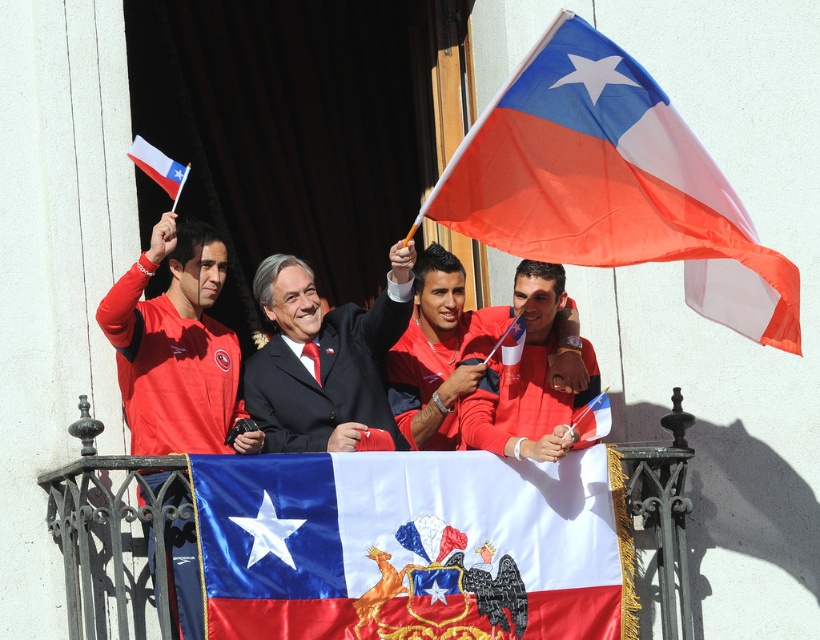
Question: Among these objects, which one is farthest from the camera?

Choices:
 (A) matte fabric flag at center
 (B) matte black suit at center
 (C) matte red jacket at center
 (D) matte orange flag at upper right

Answer: (C)

Question: Does matte red shirt at center appear on the right side of white fabric flag at upper left?

Choices:
 (A) no
 (B) yes

Answer: (B)

Question: Observing the image, what is the correct spatial positioning of matte black suit at center in reference to matte red shirt at center?

Choices:
 (A) left
 (B) right

Answer: (A)

Question: Which of the following is the farthest from the observer?

Choices:
 (A) matte red shirt at center
 (B) matte orange flag at upper right
 (C) matte black suit at center
 (D) matte fabric flag at center

Answer: (A)

Question: Estimate the real-world distances between objects in this image. Which object is farther from the white fabric flag at upper left?

Choices:
 (A) matte black suit at center
 (B) matte red jacket at left

Answer: (A)

Question: In this image, where is matte red jacket at left located relative to matte red shirt at center?

Choices:
 (A) left
 (B) right

Answer: (A)